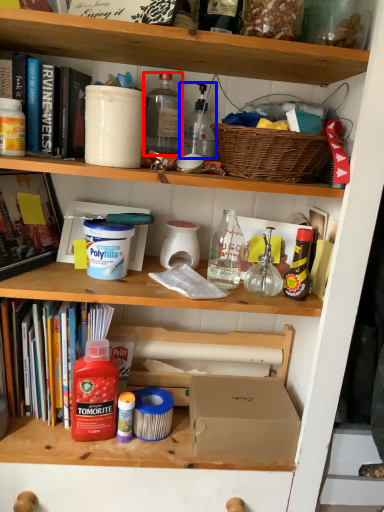
Question: Which object is further to the camera taking this photo, bottle (highlighted by a red box) or bottle (highlighted by a blue box)?

Choices:
 (A) bottle
 (B) bottle

Answer: (B)